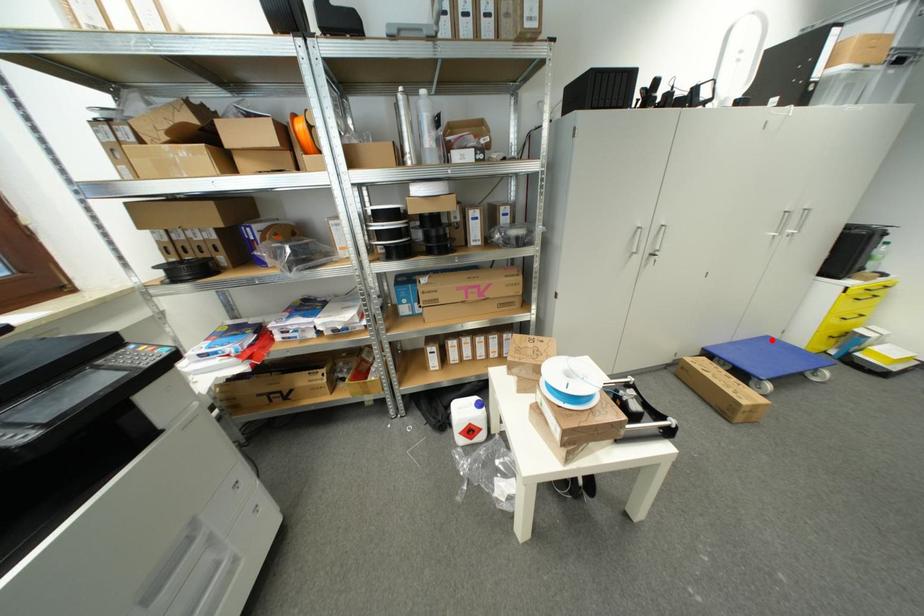
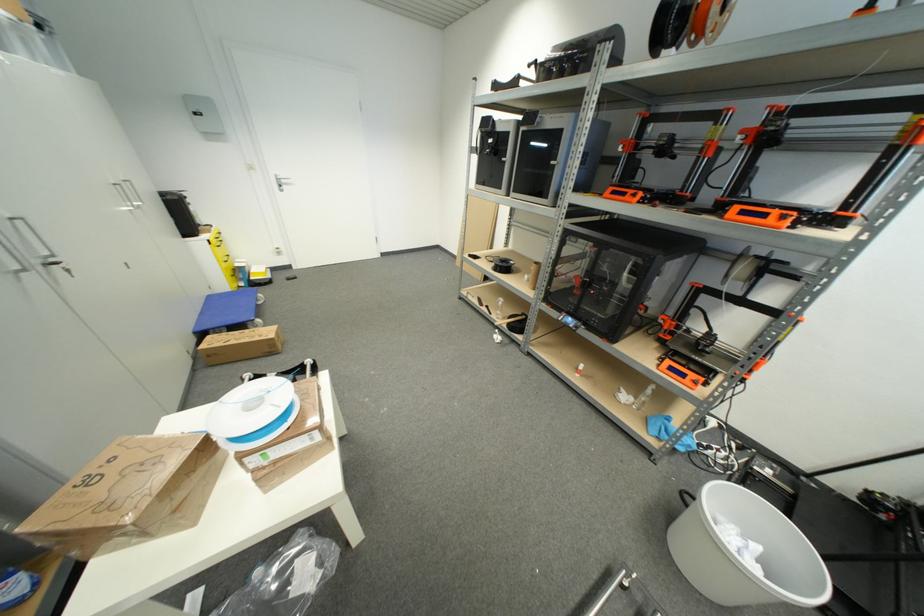
Locate, in the second image, the point that corresponds to the highlighted location in the first image.

(213, 299)